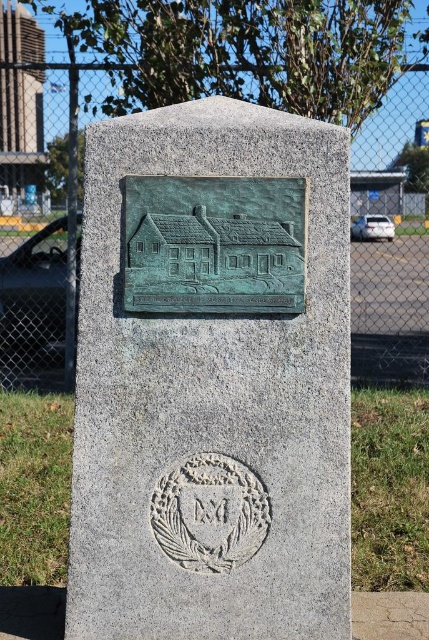
Between bronze plaque at center and green patina plaque at center, which one has less height?

green patina plaque at center

Does bronze plaque at center have a greater width compared to green patina plaque at center?

Yes, bronze plaque at center is wider than green patina plaque at center.

What are the coordinates of `bronze plaque at center` in the screenshot? It's located at (211, 378).

How far apart are metal chain-link fence at upper center and green patina plaque at center?

metal chain-link fence at upper center is 5.26 meters from green patina plaque at center.

This screenshot has height=640, width=429. I want to click on metal chain-link fence at upper center, so click(x=390, y=248).

The width and height of the screenshot is (429, 640). Find the location of `bronze plaque at center`. bronze plaque at center is located at coordinates click(x=211, y=378).

Who is higher up, bronze plaque at center or metal chain-link fence at upper center?

metal chain-link fence at upper center is higher up.

This screenshot has width=429, height=640. Find the location of `bronze plaque at center`. bronze plaque at center is located at coordinates (211, 378).